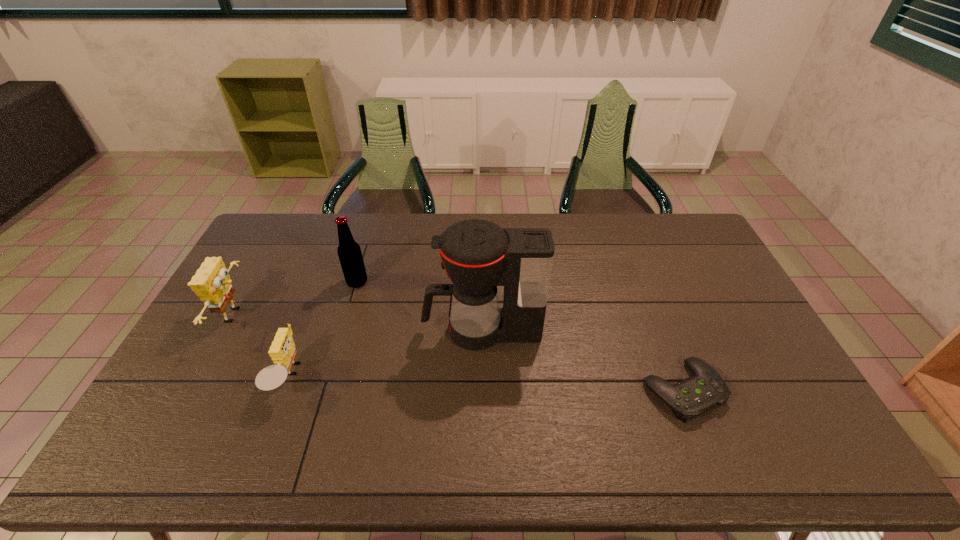
Locate an element on the screen. The width and height of the screenshot is (960, 540). free area in between the second object from left to right and the control is located at coordinates (486, 384).

The height and width of the screenshot is (540, 960). I want to click on vacant area that lies between the fourth shortest object and the leftmost object, so click(x=297, y=299).

Identify the location of free space between the leftmost object and the tallest object. (358, 322).

The image size is (960, 540). Find the location of `object that can be found as the closest to the coffee maker`. object that can be found as the closest to the coffee maker is located at coordinates (349, 252).

Where is `object that can be found as the second closest to the fourth object from right to left`? object that can be found as the second closest to the fourth object from right to left is located at coordinates (349, 252).

I want to click on blank space that satisfies the following two spatial constraints: 1. on the front-facing side of the shortest object; 2. on the left side of the second shortest object, so click(x=284, y=390).

The width and height of the screenshot is (960, 540). I want to click on vacant area that satisfies the following two spatial constraints: 1. on the front side of the fourth shortest object; 2. on the face of the leftmost object, so click(348, 315).

Identify the location of blank area in the image that satisfies the following two spatial constraints: 1. on the face of the left sponge; 2. on the back side of the shortest object. (195, 390).

The width and height of the screenshot is (960, 540). What are the coordinates of `vacant position in the image that satisfies the following two spatial constraints: 1. on the front side of the second tallest object; 2. on the front-facing side of the right sponge` in the screenshot? It's located at (329, 377).

Find the location of a particular element. This screenshot has width=960, height=540. free location that satisfies the following two spatial constraints: 1. on the front side of the third object from right to left; 2. on the front-facing side of the right sponge is located at coordinates (329, 377).